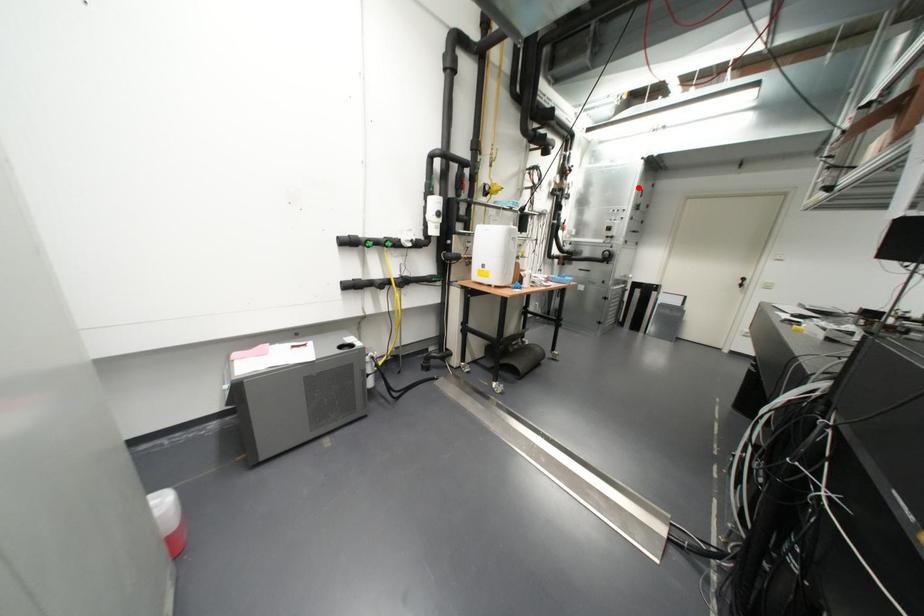
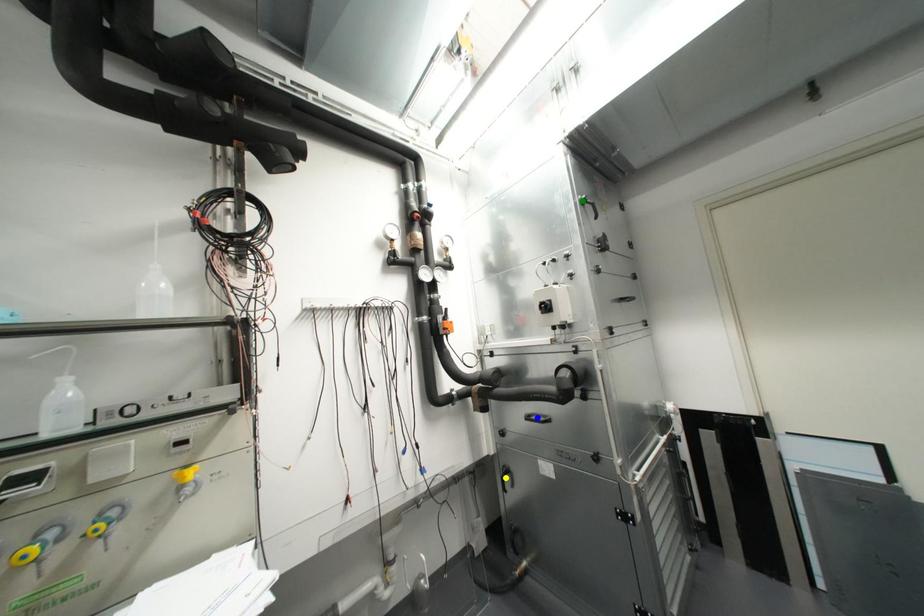
Question: I am providing you with two images of the same scene from different viewpoints. A red point is marked on the first image. You are given multiple points on the second image. Which point in image 2 is actually the same real-world point as the red point in image 1?

Choices:
 (A) green point
 (B) blue point
 (C) yellow point

Answer: (A)